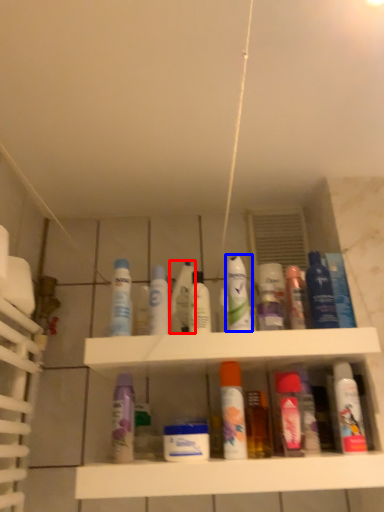
Question: Which of the following is the closest to the observer, mouthwash (highlighted by a red box) or mouthwash (highlighted by a blue box)?

Choices:
 (A) mouthwash
 (B) mouthwash

Answer: (B)